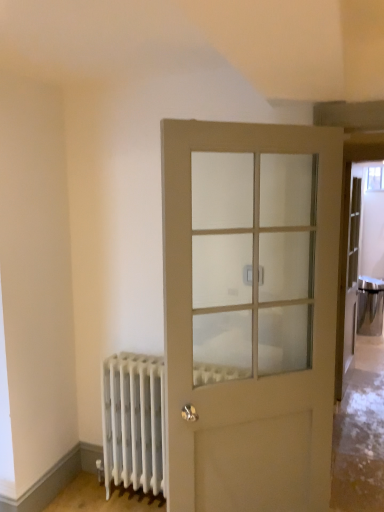
Identify the location of satin silver door handle at center. The height and width of the screenshot is (512, 384). (247, 275).

Between satin silver door handle at center and matte white door at center, which one has smaller size?

Smaller between the two is satin silver door handle at center.

Could matte white door at center be considered to be inside satin silver door handle at center?

No, matte white door at center is not surrounded by satin silver door handle at center.

Is satin silver door handle at center next to matte white door at center and touching it?

satin silver door handle at center and matte white door at center are clearly separated.

Is point (263, 270) closer to viewer compared to point (219, 463)?

That is False.

In terms of height, does satin silver door handle at center look taller or shorter compared to white matte radiator at lower left?

In the image, satin silver door handle at center appears to be shorter than white matte radiator at lower left.

Is the depth of satin silver door handle at center greater than that of white matte radiator at lower left?

No, it is in front of white matte radiator at lower left.

Is point (251, 268) closer to viewer compared to point (146, 355)?

Yes, point (251, 268) is closer to viewer.

Is white matte radiator at lower left positioned before matte white door at center?

No.

Is white matte radiator at lower left bigger than matte white door at center?

No, white matte radiator at lower left is not bigger than matte white door at center.

Do you think white matte radiator at lower left is within matte white door at center, or outside of it?

white matte radiator at lower left lies outside matte white door at center.

Based on the photo, is white matte radiator at lower left beside matte white door at center?

No, white matte radiator at lower left is not making contact with matte white door at center.

Is point (130, 484) positioned after point (248, 268)?

Yes, point (130, 484) is behind point (248, 268).

Which is more to the left, white matte radiator at lower left or satin silver door handle at center?

white matte radiator at lower left is more to the left.

At what (x,y) coordinates should I click in order to perform the action: click on door handle located above the white matte radiator at lower left (from the image's perspective). Please return your answer as a coordinate pair (x, y). The image size is (384, 512). Looking at the image, I should click on (247, 275).

Looking at this image, is white matte radiator at lower left facing towards satin silver door handle at center?

No, white matte radiator at lower left is not oriented towards satin silver door handle at center.

Consider the image. Can you confirm if matte white door at center is bigger than satin silver door handle at center?

Correct, matte white door at center is larger in size than satin silver door handle at center.

Is matte white door at center positioned with its back to satin silver door handle at center?

Yes, matte white door at center's orientation is away from satin silver door handle at center.

Is matte white door at center far from satin silver door handle at center?

No, matte white door at center is not far from satin silver door handle at center.

From the image's perspective, who appears lower, matte white door at center or white matte radiator at lower left?

white matte radiator at lower left is shown below in the image.

Is matte white door at center aimed at white matte radiator at lower left?

No, matte white door at center does not turn towards white matte radiator at lower left.

Is white matte radiator at lower left inside matte white door at center?

No, white matte radiator at lower left is not inside matte white door at center.

Locate an element on the screen. Image resolution: width=384 pixels, height=512 pixels. radiator lying below the matte white door at center (from the image's perspective) is located at coordinates (133, 422).

You are a GUI agent. You are given a task and a screenshot of the screen. Output one action in this format:
    pyautogui.click(x=<x>, y=<y>)
    Task: Click on the door that appears on the left of satin silver door handle at center
    
    Given the screenshot: What is the action you would take?
    pyautogui.click(x=251, y=380)

The image size is (384, 512). I want to click on radiator that is under the satin silver door handle at center (from a real-world perspective), so click(133, 422).

Based on their spatial positions, is matte white door at center or satin silver door handle at center closer to white matte radiator at lower left?

matte white door at center is closer to white matte radiator at lower left.

Looking at the image, which one is located further to satin silver door handle at center, white matte radiator at lower left or matte white door at center?

Among the two, white matte radiator at lower left is located further to satin silver door handle at center.

Which object lies nearer to the anchor point matte white door at center, satin silver door handle at center or white matte radiator at lower left?

satin silver door handle at center lies closer to matte white door at center than the other object.

Estimate the real-world distances between objects in this image. Which object is further from satin silver door handle at center, matte white door at center or white matte radiator at lower left?

The object further to satin silver door handle at center is white matte radiator at lower left.

When comparing their distances from white matte radiator at lower left, does satin silver door handle at center or matte white door at center seem further?

satin silver door handle at center is positioned further to the anchor white matte radiator at lower left.

Looking at the image, which one is located further to matte white door at center, white matte radiator at lower left or satin silver door handle at center?

white matte radiator at lower left is positioned further to the anchor matte white door at center.

The image size is (384, 512). Identify the location of door between satin silver door handle at center and white matte radiator at lower left in the up-down direction. (251, 380).